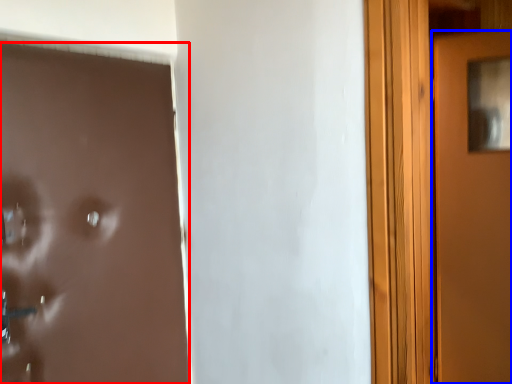
Question: Which point is further to the camera, door (highlighted by a red box) or door (highlighted by a blue box)?

Choices:
 (A) door
 (B) door

Answer: (B)